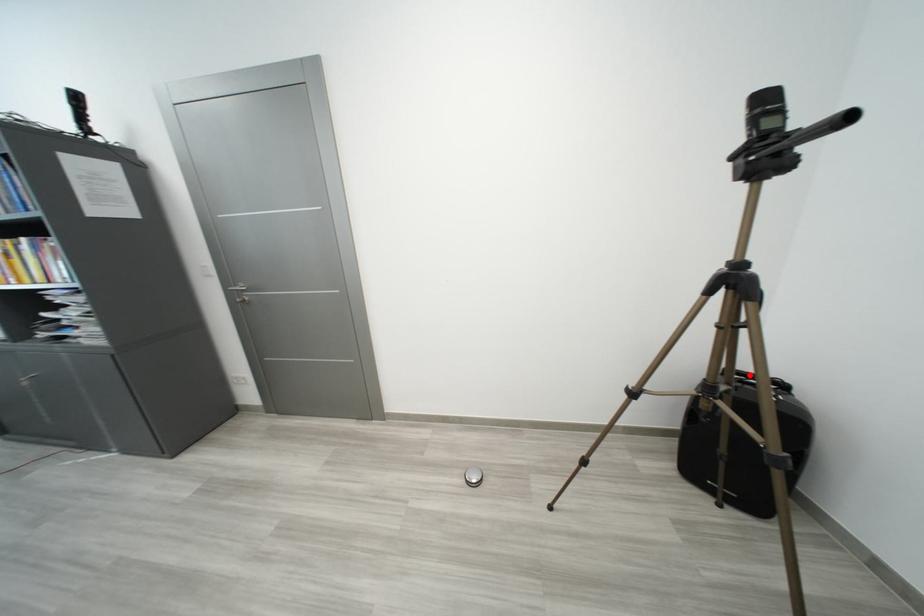
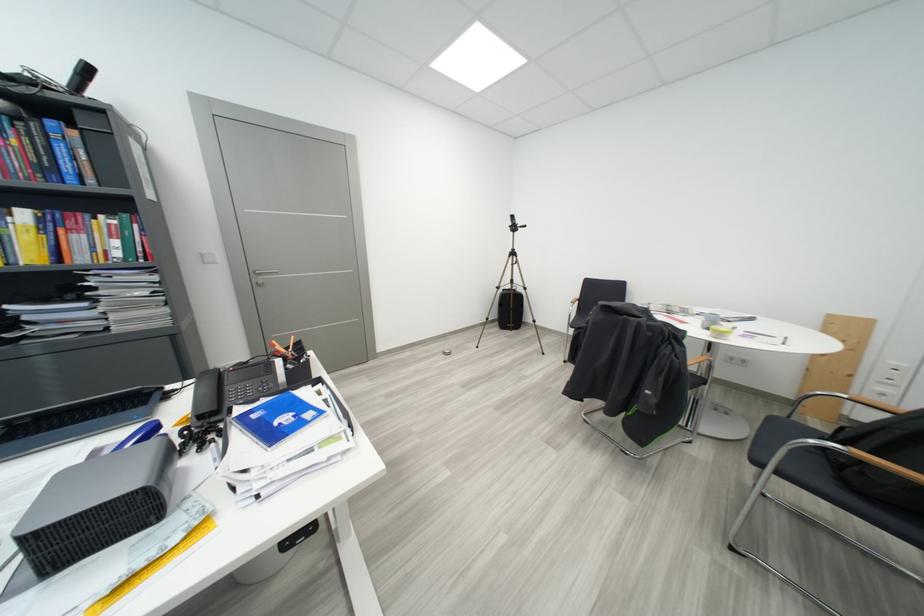
Question: I am providing you with two images of the same scene from different viewpoints. A red point is marked on the first image. Can you still see the location of the red point in image 2?

Choices:
 (A) Yes
 (B) No

Answer: (B)